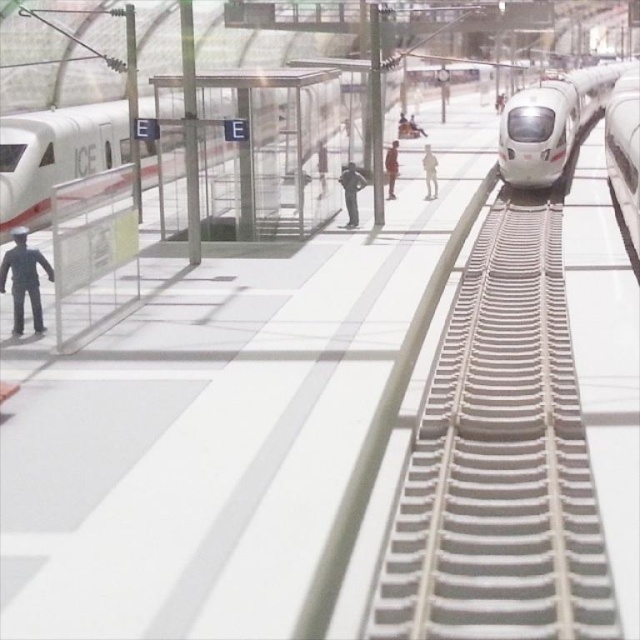
Question: Considering the relative positions of white glossy train at left and white glossy train at right in the image provided, where is white glossy train at left located with respect to white glossy train at right?

Choices:
 (A) left
 (B) right

Answer: (A)

Question: Which is farther from the black matte figure at left?

Choices:
 (A) white matte figure at center
 (B) white glossy train at center
 (C) white glossy train at left

Answer: (B)

Question: From the image, what is the correct spatial relationship of gray metallic train track at center in relation to black matte figure at left?

Choices:
 (A) left
 (B) right

Answer: (B)

Question: Estimate the real-world distances between objects in this image. Which object is farther from the white matte figure at center?

Choices:
 (A) black matte figure at left
 (B) gray metallic train track at center
 (C) dark brown leather jacket at center
 (D) white glossy train at center

Answer: (D)

Question: Is gray metallic train track at center thinner than white matte figure at center?

Choices:
 (A) no
 (B) yes

Answer: (A)

Question: Which point appears closest to the camera in this image?

Choices:
 (A) (589, 620)
 (B) (35, 259)

Answer: (A)